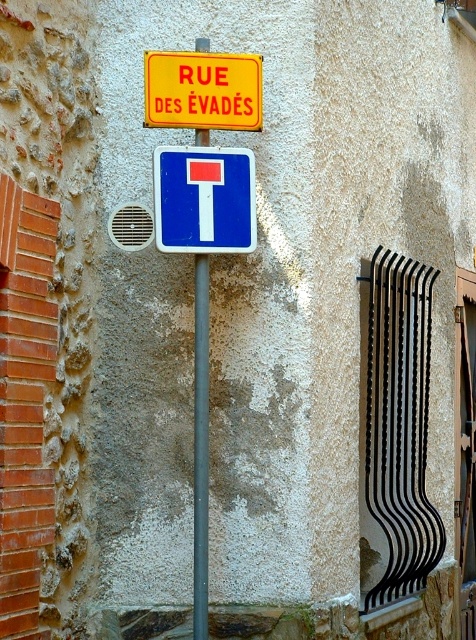
Measure the distance from blue plastic sign at center to yellow plastic sign at upper center.

blue plastic sign at center is 21.51 centimeters away from yellow plastic sign at upper center.

Which is above, blue plastic sign at center or yellow plastic sign at upper center?

Positioned higher is yellow plastic sign at upper center.

What do you see at coordinates (204, 198) in the screenshot? The height and width of the screenshot is (640, 476). I see `blue plastic sign at center` at bounding box center [204, 198].

Find the location of `blue plastic sign at center`. blue plastic sign at center is located at coordinates (204, 198).

Does yellow plastic sign at upper center have a lesser width compared to metallic pole at center?

In fact, yellow plastic sign at upper center might be wider than metallic pole at center.

Which is below, yellow plastic sign at upper center or metallic pole at center?

metallic pole at center is below.

Is point (157, 83) behind point (199, 374)?

No, (157, 83) is in front of (199, 374).

This screenshot has height=640, width=476. Find the location of `yellow plastic sign at upper center`. yellow plastic sign at upper center is located at coordinates (202, 90).

Who is more distant from viewer, (249, 225) or (198, 602)?

Point (249, 225)

Between blue plastic sign at center and metallic pole at center, which one appears on the left side from the viewer's perspective?

metallic pole at center is more to the left.

Where is `blue plastic sign at center`? The image size is (476, 640). blue plastic sign at center is located at coordinates (204, 198).